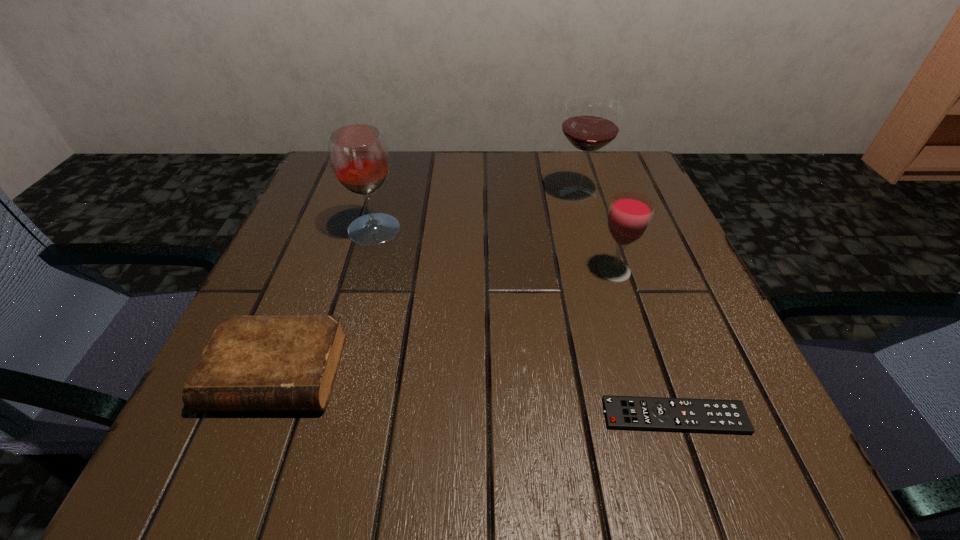
You are a GUI agent. You are given a task and a screenshot of the screen. Output one action in this format:
    pyautogui.click(x=<x>, y=<y>)
    Task: Click on the object that is positioned at the near right corner
    
    Given the screenshot: What is the action you would take?
    click(716, 416)

The height and width of the screenshot is (540, 960). I want to click on vacant space at the far edge of the desktop, so click(x=490, y=180).

In the image, there is a desktop. At what (x,y) coordinates should I click in order to perform the action: click on free space at the near edge. Please return your answer as a coordinate pair (x, y). This screenshot has width=960, height=540. Looking at the image, I should click on (331, 478).

Locate an element on the screen. The width and height of the screenshot is (960, 540). vacant space at the left edge of the desktop is located at coordinates (271, 261).

The height and width of the screenshot is (540, 960). I want to click on vacant space at the right edge of the desktop, so click(x=628, y=286).

In the image, there is a desktop. Identify the location of vacant space at the far right corner. 598,199.

Identify the location of free space at the near right corner of the desktop. (725, 464).

I want to click on unoccupied area between the third tallest object and the fourth tallest object, so click(x=445, y=322).

This screenshot has height=540, width=960. Identify the location of empty space that is in between the remote control and the second nearest wineglass. (524, 323).

Locate an element on the screen. This screenshot has width=960, height=540. free spot between the diary and the second farthest wineglass is located at coordinates (325, 301).